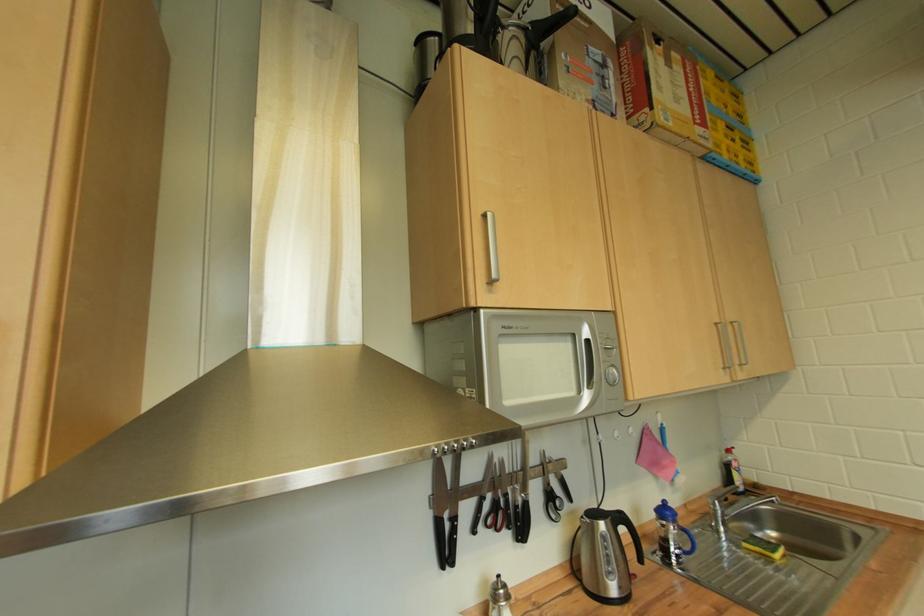
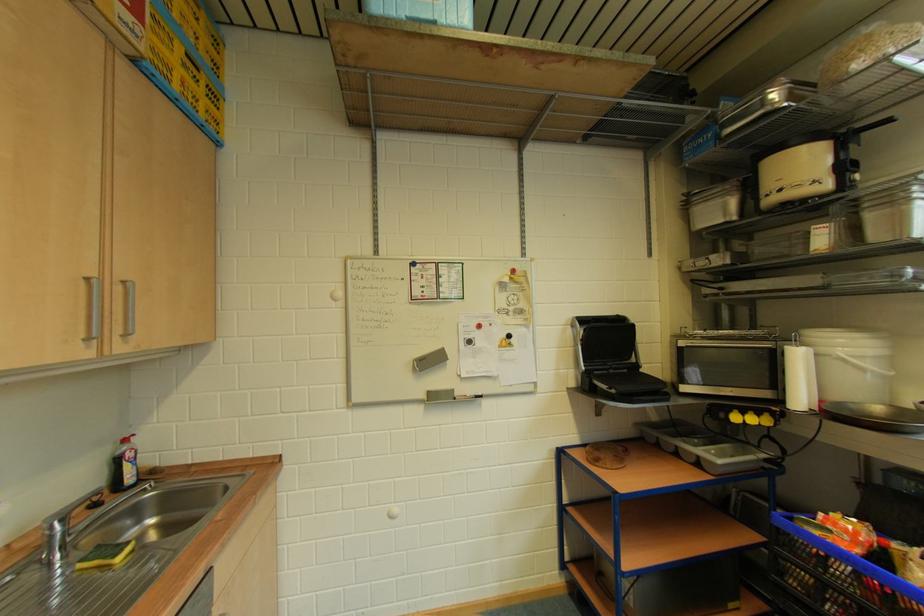
Find the pixel in the second image that matches the point at 719,148 in the first image.

(150, 50)